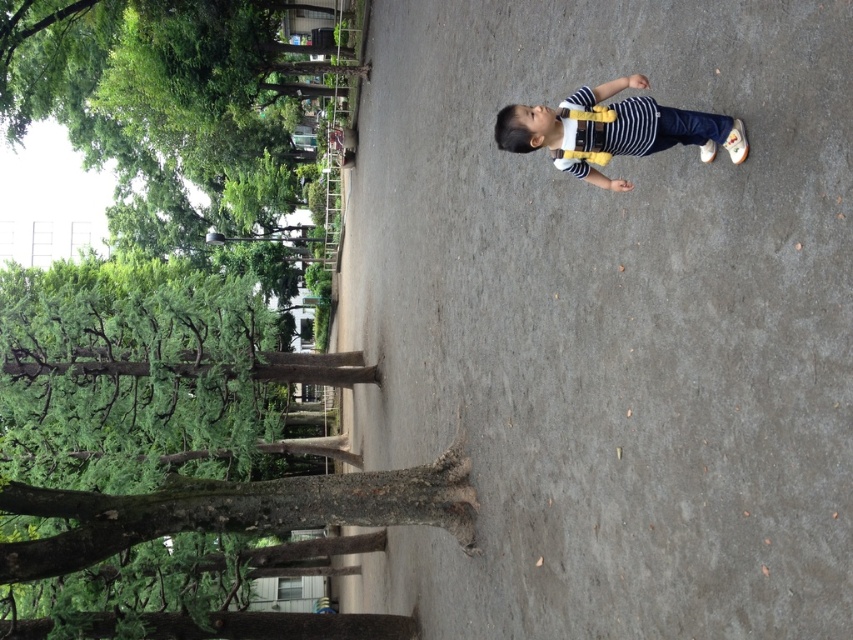
Is point (643, 259) positioned after point (521, 109)?

Yes, it is behind point (521, 109).

Which is in front, point (776, 196) or point (727, 115)?

Point (776, 196) is more forward.

Identify the location of gray concrete at center. The width and height of the screenshot is (853, 640). (611, 323).

Is gray concrete at center smaller than brown rough tree trunk at center?

Yes.

Between point (659, 257) and point (26, 413), which one is positioned behind?

Positioned behind is point (26, 413).

Where is `gray concrete at center`? gray concrete at center is located at coordinates (611, 323).

Between brown rough tree trunk at center and white matte suspenders at center, which one appears on the left side from the viewer's perspective?

brown rough tree trunk at center is more to the left.

Does point (90, 513) come behind point (721, 131)?

That is True.

The height and width of the screenshot is (640, 853). I want to click on brown rough tree trunk at center, so click(170, 452).